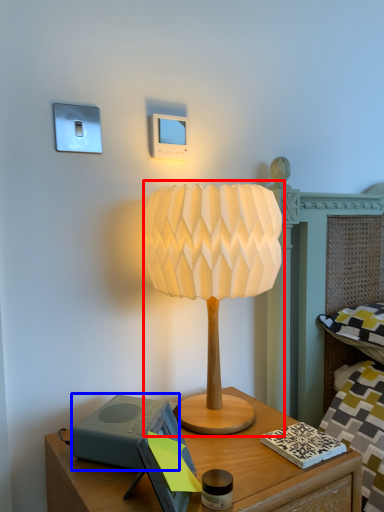
Question: Which point is further to the camera, lamp (highlighted by a red box) or speaker (highlighted by a blue box)?

Choices:
 (A) lamp
 (B) speaker

Answer: (B)